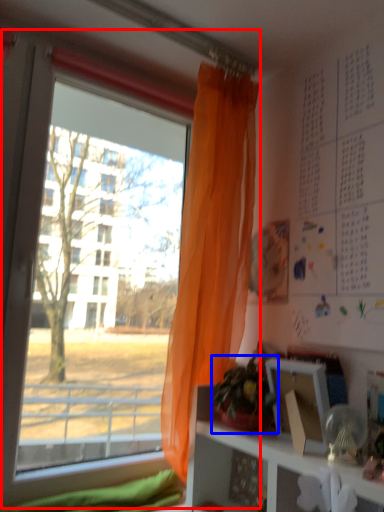
Question: Which object is closer to the camera taking this photo, window (highlighted by a red box) or houseplant (highlighted by a blue box)?

Choices:
 (A) window
 (B) houseplant

Answer: (A)